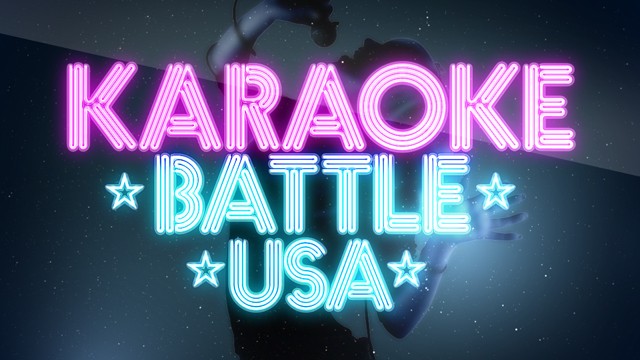
Find the location of `blue neon letters`. blue neon letters is located at coordinates (164, 197), (230, 205), (300, 192), (349, 190), (392, 203), (448, 211), (234, 275), (307, 274), (347, 273).